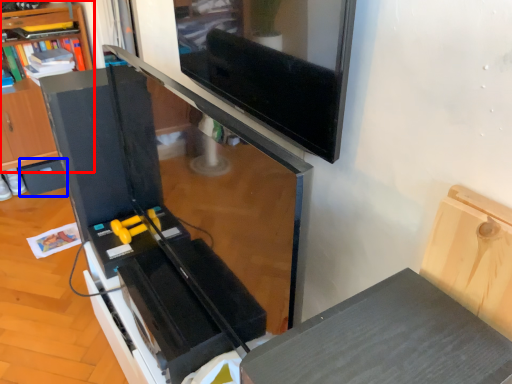
Question: Which point is closer to the camera, shelf (highlighted by a red box) or drawer (highlighted by a blue box)?

Choices:
 (A) shelf
 (B) drawer

Answer: (A)